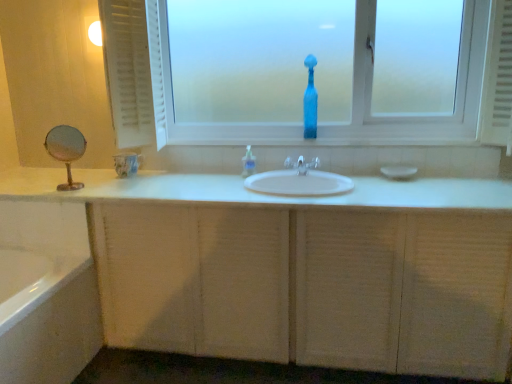
What are the coordinates of `free space behind clear plastic faucet at center` in the screenshot? It's located at (295, 167).